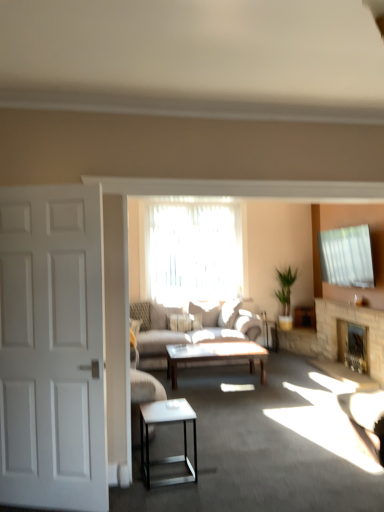
Question: Should I look upward or downward to see wooden polished coffee table at center?

Choices:
 (A) up
 (B) down

Answer: (B)

Question: Does white matte door at left have a greater height compared to stone fireplace at center, the first fireplace from the front?

Choices:
 (A) yes
 (B) no

Answer: (A)

Question: Could you tell me if white matte door at left is facing stone fireplace at center, the first fireplace from the front?

Choices:
 (A) no
 (B) yes

Answer: (A)

Question: Does white matte door at left have a larger size compared to stone fireplace at center, the first fireplace from the front?

Choices:
 (A) no
 (B) yes

Answer: (B)

Question: From a real-world perspective, is white matte door at left on stone fireplace at center, the first fireplace from the front?

Choices:
 (A) no
 (B) yes

Answer: (B)

Question: From the image's perspective, is white matte door at left beneath stone fireplace at center, the second fireplace from the back?

Choices:
 (A) no
 (B) yes

Answer: (A)

Question: Considering the relative sizes of white matte door at left and stone fireplace at center, the second fireplace from the back, in the image provided, is white matte door at left wider than stone fireplace at center, the second fireplace from the back,?

Choices:
 (A) no
 (B) yes

Answer: (A)

Question: Considering the relative sizes of white glossy side table at lower center and translucent fabric at center in the image provided, is white glossy side table at lower center wider than translucent fabric at center?

Choices:
 (A) yes
 (B) no

Answer: (A)

Question: Does white glossy side table at lower center turn towards translucent fabric at center?

Choices:
 (A) no
 (B) yes

Answer: (A)

Question: Does white glossy side table at lower center lie behind translucent fabric at center?

Choices:
 (A) yes
 (B) no

Answer: (B)

Question: Is translucent fabric at center inside white glossy side table at lower center?

Choices:
 (A) no
 (B) yes

Answer: (A)

Question: Considering the relative sizes of white glossy side table at lower center and translucent fabric at center in the image provided, is white glossy side table at lower center smaller than translucent fabric at center?

Choices:
 (A) yes
 (B) no

Answer: (A)

Question: Considering the relative positions of white glossy side table at lower center and translucent fabric at center in the image provided, is white glossy side table at lower center to the left of translucent fabric at center from the viewer's perspective?

Choices:
 (A) yes
 (B) no

Answer: (A)

Question: From the image's perspective, does light gray fabric couch at center appear higher than stone fireplace at center, the second fireplace from the back?

Choices:
 (A) yes
 (B) no

Answer: (B)